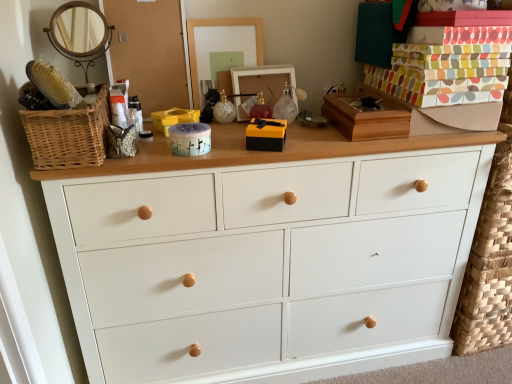
Question: Is yellow plastic storage box at center completely or partially outside of white painted wood chest of drawers at center?

Choices:
 (A) yes
 (B) no

Answer: (A)

Question: Is the position of yellow plastic storage box at center more distant than that of white painted wood chest of drawers at center?

Choices:
 (A) yes
 (B) no

Answer: (A)

Question: From the image's perspective, does yellow plastic storage box at center appear higher than white painted wood chest of drawers at center?

Choices:
 (A) yes
 (B) no

Answer: (A)

Question: From a real-world perspective, is yellow plastic storage box at center positioned over white painted wood chest of drawers at center based on gravity?

Choices:
 (A) yes
 (B) no

Answer: (A)

Question: Does yellow plastic storage box at center have a smaller size compared to white painted wood chest of drawers at center?

Choices:
 (A) no
 (B) yes

Answer: (B)

Question: From a real-world perspective, is wooden picture frame at center above or below matte glass ornament at center?

Choices:
 (A) below
 (B) above

Answer: (B)

Question: Relative to matte glass ornament at center, is wooden picture frame at center in front or behind?

Choices:
 (A) behind
 (B) front

Answer: (B)

Question: Is wooden picture frame at center taller or shorter than matte glass ornament at center?

Choices:
 (A) short
 (B) tall

Answer: (B)

Question: Is wooden picture frame at center situated inside matte glass ornament at center or outside?

Choices:
 (A) outside
 (B) inside

Answer: (A)

Question: Is point (227, 100) positioned closer to the camera than point (169, 110)?

Choices:
 (A) closer
 (B) farther

Answer: (B)

Question: Do you think matte glass ornament at center is within yellow plastic storage box at center, or outside of it?

Choices:
 (A) outside
 (B) inside

Answer: (A)

Question: From a real-world perspective, is matte glass ornament at center positioned above or below yellow plastic storage box at center?

Choices:
 (A) below
 (B) above

Answer: (B)

Question: From the image's perspective, is matte glass ornament at center above or below yellow plastic storage box at center?

Choices:
 (A) above
 (B) below

Answer: (A)

Question: Considering the relative positions of white painted wood chest of drawers at center and woven wood basket at left in the image provided, is white painted wood chest of drawers at center to the left or to the right of woven wood basket at left?

Choices:
 (A) right
 (B) left

Answer: (A)

Question: From the image's perspective, is white painted wood chest of drawers at center positioned above or below woven wood basket at left?

Choices:
 (A) below
 (B) above

Answer: (A)